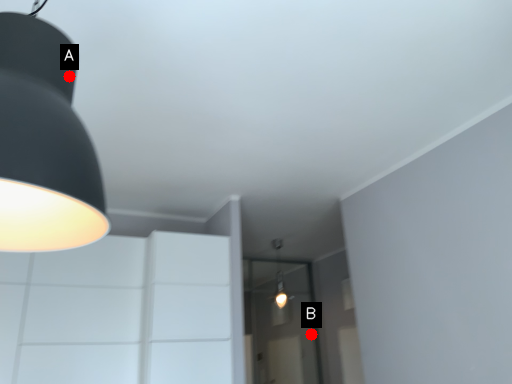
Question: Two points are circled on the image, labeled by A and B beside each circle. Which point appears closest to the camera in this image?

Choices:
 (A) A is closer
 (B) B is closer

Answer: (A)